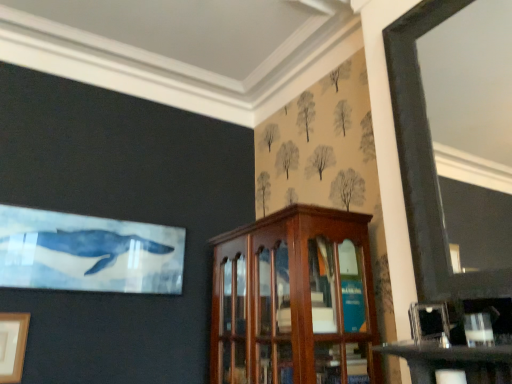
Question: Does wooden picture frame at lower left, acting as the 2th picture frame starting from the front, appear on the left side of mahogany wood cabinet at center?

Choices:
 (A) no
 (B) yes

Answer: (B)

Question: From the image's perspective, is wooden picture frame at lower left, positioned as the 1th picture frame in back-to-front order, on top of mahogany wood cabinet at center?

Choices:
 (A) no
 (B) yes

Answer: (A)

Question: Does wooden picture frame at lower left, positioned as the 1th picture frame in bottom-to-top order, appear on the right side of mahogany wood cabinet at center?

Choices:
 (A) yes
 (B) no

Answer: (B)

Question: Is wooden picture frame at lower left, which is counted as the 2th picture frame, starting from the top, turned away from mahogany wood cabinet at center?

Choices:
 (A) yes
 (B) no

Answer: (B)

Question: Is wooden picture frame at lower left, which is the 2th picture frame in right-to-left order, bigger than mahogany wood cabinet at center?

Choices:
 (A) yes
 (B) no

Answer: (B)

Question: Is wooden picture frame at lower left, acting as the 1th picture frame starting from the left, far away from mahogany wood cabinet at center?

Choices:
 (A) yes
 (B) no

Answer: (A)

Question: Considering the relative sizes of mahogany wood cabinet at center and wooden picture frame at lower left, which is the 2th picture frame in right-to-left order, in the image provided, is mahogany wood cabinet at center smaller than wooden picture frame at lower left, which is the 2th picture frame in right-to-left order,?

Choices:
 (A) yes
 (B) no

Answer: (B)

Question: Considering the relative positions of mahogany wood cabinet at center and wooden picture frame at lower left, acting as the 2th picture frame starting from the front, in the image provided, is mahogany wood cabinet at center behind wooden picture frame at lower left, acting as the 2th picture frame starting from the front,?

Choices:
 (A) no
 (B) yes

Answer: (A)

Question: From the image's perspective, is mahogany wood cabinet at center below wooden picture frame at lower left, positioned as the 1th picture frame in back-to-front order?

Choices:
 (A) yes
 (B) no

Answer: (B)

Question: Is mahogany wood cabinet at center wider than wooden picture frame at lower left, which is counted as the 2th picture frame, starting from the top?

Choices:
 (A) yes
 (B) no

Answer: (A)

Question: Is mahogany wood cabinet at center shorter than wooden picture frame at lower left, which is counted as the 2th picture frame, starting from the top?

Choices:
 (A) no
 (B) yes

Answer: (A)

Question: Is mahogany wood cabinet at center to the right of wooden picture frame at lower left, which is the 2th picture frame in right-to-left order, from the viewer's perspective?

Choices:
 (A) no
 (B) yes

Answer: (B)

Question: Is metallic silver picture frame at lower right, which ranks as the first picture frame in top-to-bottom order, not within wooden picture frame at lower left, acting as the 2th picture frame starting from the front?

Choices:
 (A) yes
 (B) no

Answer: (A)